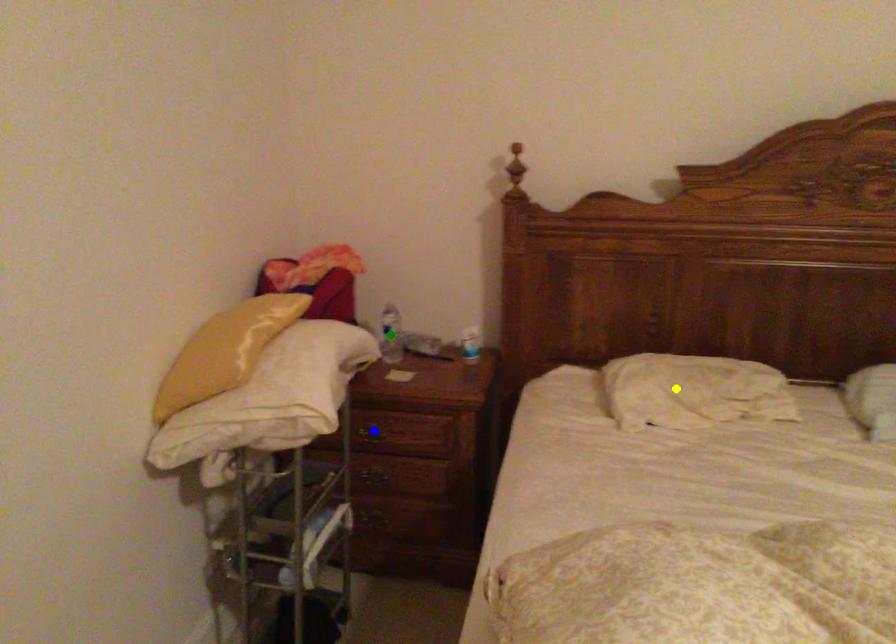
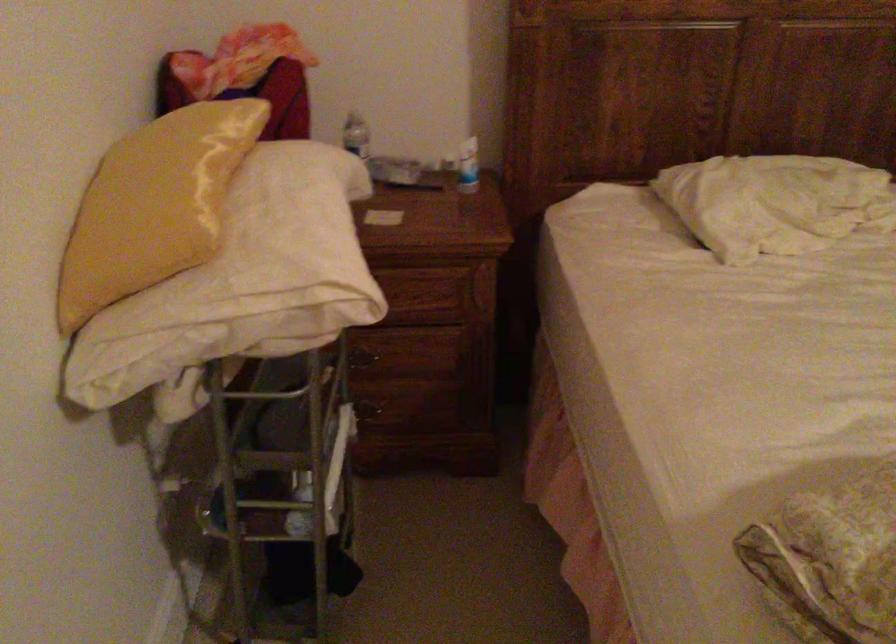
I am providing you with two images of the same scene from different viewpoints. Three points are marked in image1. Which point corresponds to a part or object that is occluded in image2?In image1, three points are marked. Which of them correspond to a part or object that is occluded in image2?Among the three points shown in image1, which one corresponds to a part or object that is no longer visible due to occlusion in image2?

blue point, green point cannot be seen in image2.